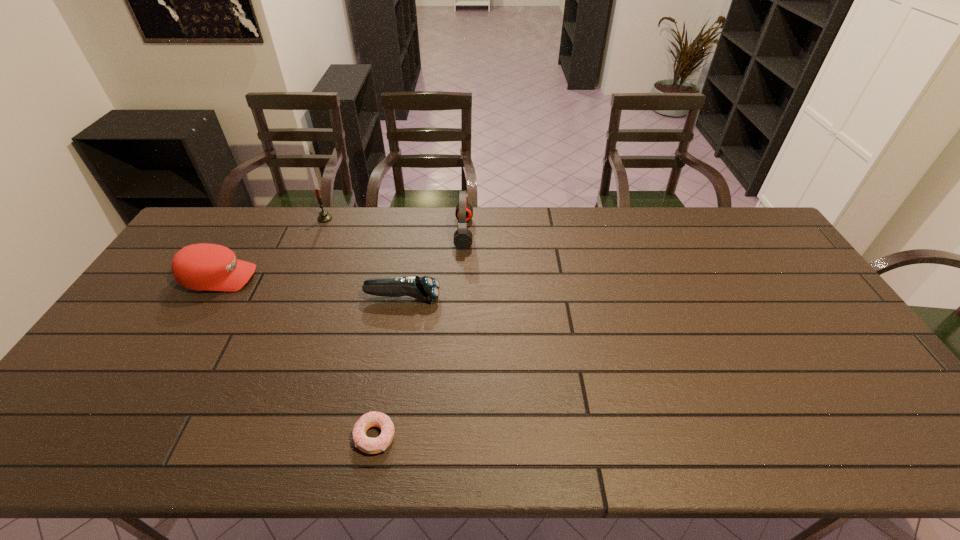
Locate an element on the screen. blank space located 0.240m on the right of the candle is located at coordinates (398, 219).

The height and width of the screenshot is (540, 960). Identify the location of vacant area located 0.260m on the front-facing side of the third shortest object. (341, 278).

Where is `vacant area situated 0.300m on the head of the electric shaver`? vacant area situated 0.300m on the head of the electric shaver is located at coordinates (540, 298).

Where is `free space located 0.270m on the left of the doughnut`? This screenshot has height=540, width=960. free space located 0.270m on the left of the doughnut is located at coordinates (236, 436).

Identify the location of earphone that is at the far edge. (463, 237).

This screenshot has width=960, height=540. Find the location of `candle that is at the far edge`. candle that is at the far edge is located at coordinates (324, 216).

You are a GUI agent. You are given a task and a screenshot of the screen. Output one action in this format:
    pyautogui.click(x=<x>, y=<y>)
    Task: Click on the object at the near edge
    
    Given the screenshot: What is the action you would take?
    pyautogui.click(x=368, y=445)

Find the location of a particular element. The width and height of the screenshot is (960, 540). object at the left edge is located at coordinates (203, 267).

The width and height of the screenshot is (960, 540). In order to click on free space at the far edge in this screenshot , I will do `click(273, 235)`.

In the image, there is a desktop. Where is `vacant space at the near edge`? Image resolution: width=960 pixels, height=540 pixels. vacant space at the near edge is located at coordinates (564, 423).